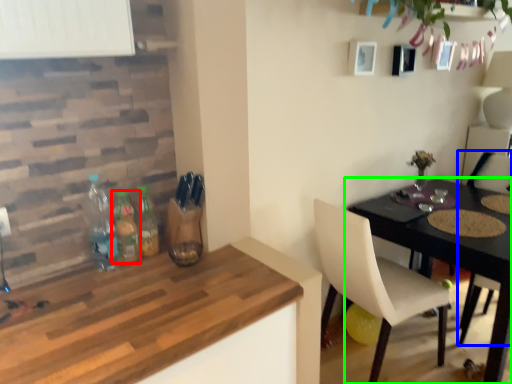
Question: Estimate the real-world distances between objects in this image. Which object is farther from bottle (highlighted by a red box), chair (highlighted by a blue box) or table (highlighted by a green box)?

Choices:
 (A) chair
 (B) table

Answer: (A)